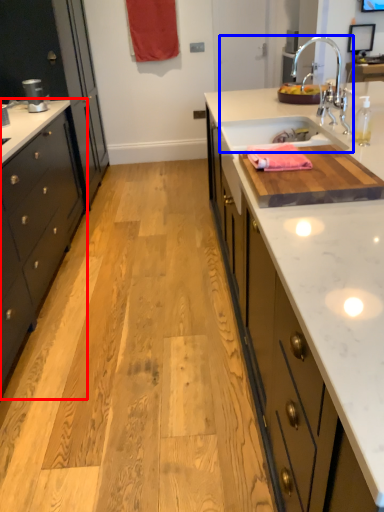
Question: Which of the following is the closest to the observer, cabinetry (highlighted by a red box) or sink (highlighted by a blue box)?

Choices:
 (A) cabinetry
 (B) sink

Answer: (A)